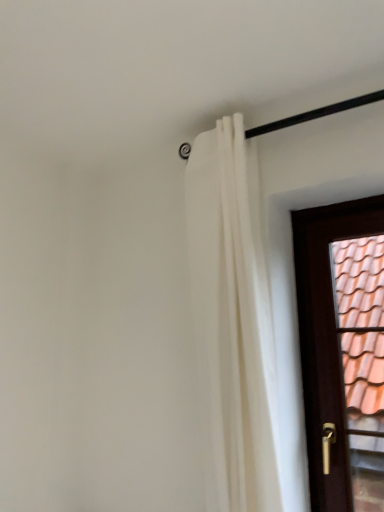
Question: Is brown wooden door at right in front of or behind white fabric curtain at upper center in the image?

Choices:
 (A) behind
 (B) front

Answer: (A)

Question: Do you think brown wooden door at right is within white fabric curtain at upper center, or outside of it?

Choices:
 (A) inside
 (B) outside

Answer: (B)

Question: Is brown wooden door at right taller or shorter than white fabric curtain at upper center?

Choices:
 (A) short
 (B) tall

Answer: (A)

Question: In terms of width, does white fabric curtain at upper center look wider or thinner when compared to brown wooden door at right?

Choices:
 (A) thin
 (B) wide

Answer: (B)

Question: Based on their sizes in the image, would you say white fabric curtain at upper center is bigger or smaller than brown wooden door at right?

Choices:
 (A) big
 (B) small

Answer: (A)

Question: Considering the positions of white fabric curtain at upper center and brown wooden door at right in the image, is white fabric curtain at upper center taller or shorter than brown wooden door at right?

Choices:
 (A) short
 (B) tall

Answer: (B)

Question: Considering their positions, is white fabric curtain at upper center located in front of or behind brown wooden door at right?

Choices:
 (A) behind
 (B) front

Answer: (B)